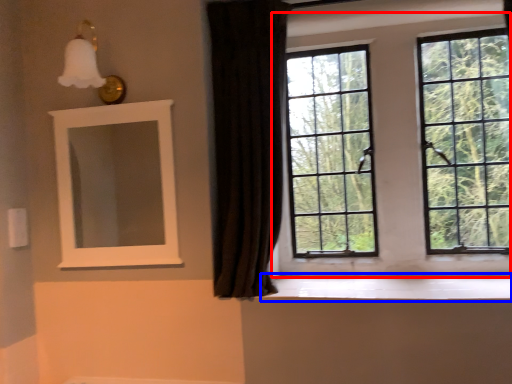
Question: Among these objects, which one is farthest to the camera, window (highlighted by a red box) or window sill (highlighted by a blue box)?

Choices:
 (A) window
 (B) window sill

Answer: (A)